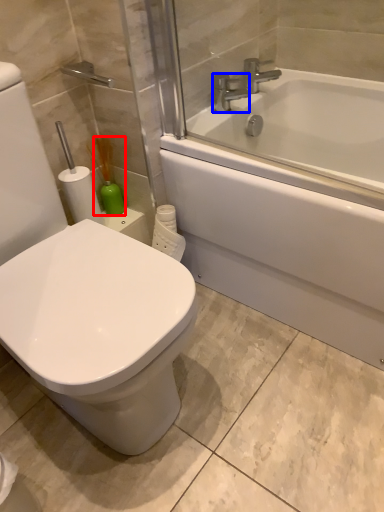
Question: Which object appears farthest to the camera in this image, soap dispenser (highlighted by a red box) or faucet (highlighted by a blue box)?

Choices:
 (A) soap dispenser
 (B) faucet

Answer: (B)